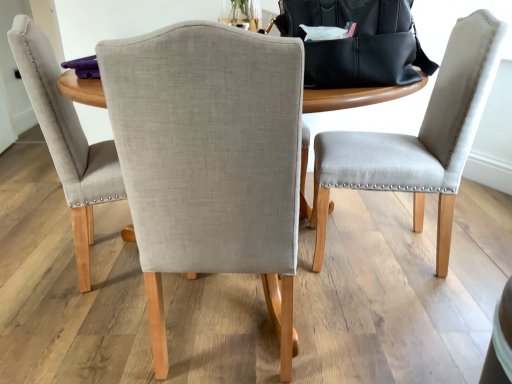
The height and width of the screenshot is (384, 512). I want to click on free location to the right of light gray fabric chair at center, the second chair in the right-to-left sequence, so click(x=365, y=325).